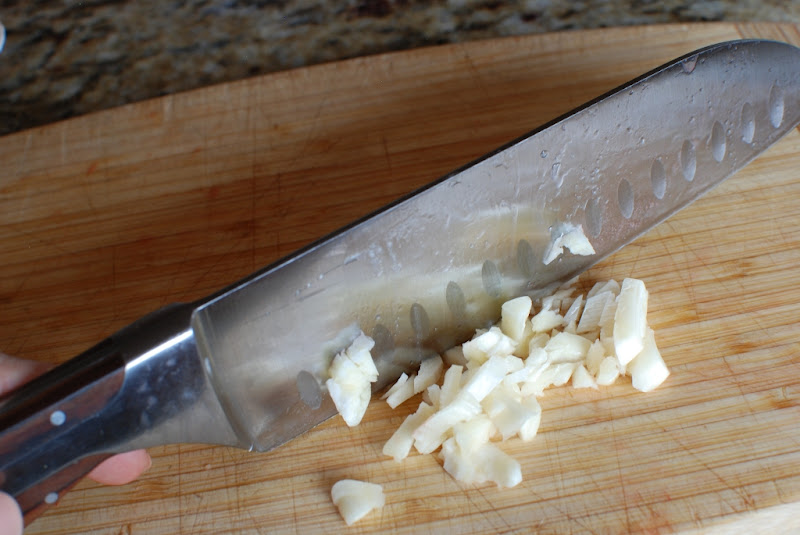
Identify the location of garlic on cutting board. (474, 410), (633, 325), (530, 364), (350, 502).